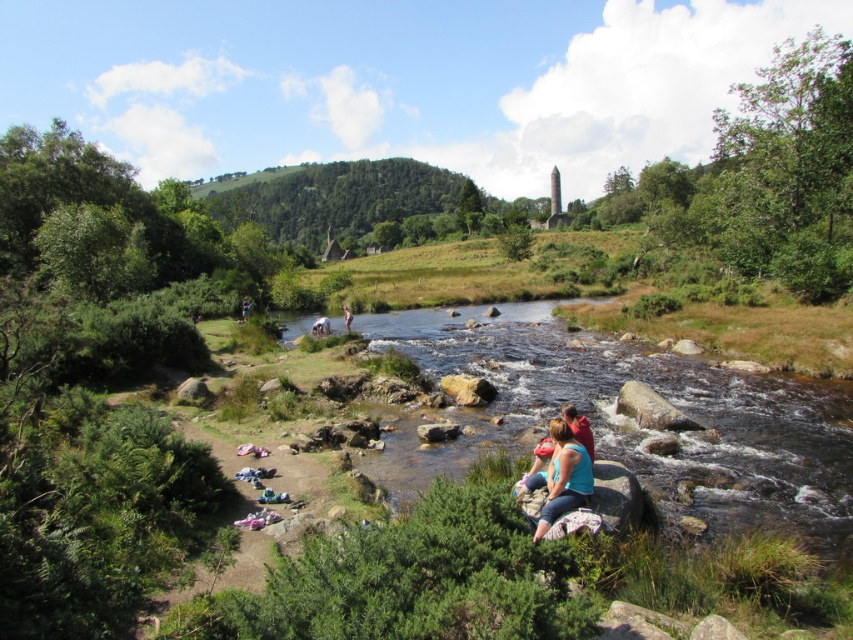
Question: Which of the following is the farthest from the observer?

Choices:
 (A) light brown wooden stick at center
 (B) blue fabric at center
 (C) light brown fabric at river center
 (D) brown rocky river at center

Answer: (A)

Question: In this image, where is brown rocky river at center located relative to light brown wooden stick at center?

Choices:
 (A) left
 (B) right

Answer: (B)

Question: Among these objects, which one is nearest to the camera?

Choices:
 (A) blue fabric at center
 (B) brown rocky river at center
 (C) light brown fabric at river center

Answer: (A)

Question: Considering the real-world distances, which object is closest to the blue fabric at center?

Choices:
 (A) brown rocky river at center
 (B) light brown fabric at river center

Answer: (A)

Question: Observing the image, what is the correct spatial positioning of brown rocky river at center in reference to light brown wooden stick at center?

Choices:
 (A) left
 (B) right

Answer: (B)

Question: Is brown rocky river at center smaller than light brown wooden stick at center?

Choices:
 (A) yes
 (B) no

Answer: (B)